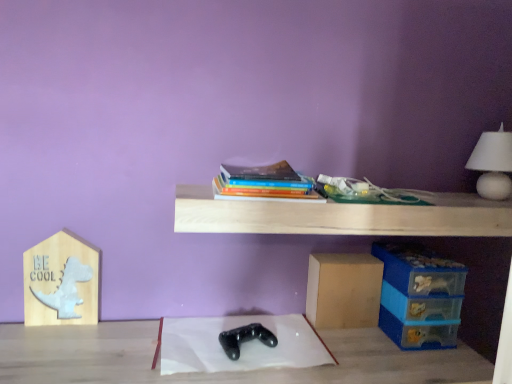
The image size is (512, 384). I want to click on wooden sign at left, arranged as the first cardboard box when viewed from the left, so click(61, 281).

Consider the image. What is the approximate width of wooden sign at left, positioned as the 2th cardboard box in back-to-front order?

It is 1.55 inches.

The height and width of the screenshot is (384, 512). What do you see at coordinates (240, 346) in the screenshot? I see `white paper at center` at bounding box center [240, 346].

Where is `white matte table lamp at upper right`? The image size is (512, 384). white matte table lamp at upper right is located at coordinates (493, 164).

Find the location of a particular element. The height and width of the screenshot is (384, 512). wooden sign at left, the second cardboard box in the right-to-left sequence is located at coordinates (61, 281).

Who is shorter, white matte table lamp at upper right or blue plastic storage box at lower right?

white matte table lamp at upper right.

Is white matte table lamp at upper right next to blue plastic storage box at lower right?

No, white matte table lamp at upper right is not next to blue plastic storage box at lower right.

Is point (482, 183) closer to viewer compared to point (419, 318)?

No, it is behind (419, 318).

Does blue plastic storage box at lower right have a lesser width compared to matte cardboard box at lower center, the 2th cardboard box from the front?

Incorrect, the width of blue plastic storage box at lower right is not less than that of matte cardboard box at lower center, the 2th cardboard box from the front.

Considering the positions of objects blue plastic storage box at lower right and matte cardboard box at lower center, the 1th cardboard box from the right, in the image provided, who is more to the right, blue plastic storage box at lower right or matte cardboard box at lower center, the 1th cardboard box from the right,?

Positioned to the right is blue plastic storage box at lower right.

Identify the location of the 1st cardboard box positioned above the blue plastic storage box at lower right (from the image's perspective). (343, 290).

Considering the sizes of objects blue plastic storage box at lower right and matte cardboard box at lower center, which is the second cardboard box in left-to-right order, in the image provided, who is smaller, blue plastic storage box at lower right or matte cardboard box at lower center, which is the second cardboard box in left-to-right order,?

Smaller between the two is matte cardboard box at lower center, which is the second cardboard box in left-to-right order.

Which object is positioned more to the right, blue plastic storage box at lower right or wooden sign at left, positioned as the 2th cardboard box in back-to-front order?

From the viewer's perspective, blue plastic storage box at lower right appears more on the right side.

Would you say wooden sign at left, the 1th cardboard box when ordered from front to back, is part of blue plastic storage box at lower right's contents?

No, wooden sign at left, the 1th cardboard box when ordered from front to back, is not inside blue plastic storage box at lower right.

Is blue plastic storage box at lower right bigger or smaller than wooden sign at left, the second cardboard box in the right-to-left sequence?

Considering their sizes, blue plastic storage box at lower right takes up more space than wooden sign at left, the second cardboard box in the right-to-left sequence.

Looking at this image, considering the sizes of objects blue plastic storage box at lower right and wooden sign at left, arranged as the first cardboard box when viewed from the left, in the image provided, who is shorter, blue plastic storage box at lower right or wooden sign at left, arranged as the first cardboard box when viewed from the left,?

blue plastic storage box at lower right.

Is blue plastic storage box at lower right looking in the opposite direction of light wood shelf at upper center?

No, blue plastic storage box at lower right's orientation is not away from light wood shelf at upper center.

Between blue plastic storage box at lower right and light wood shelf at upper center, which one has larger width?

With larger width is blue plastic storage box at lower right.

Considering the relative sizes of blue plastic storage box at lower right and light wood shelf at upper center in the image provided, is blue plastic storage box at lower right taller than light wood shelf at upper center?

Correct, blue plastic storage box at lower right is much taller as light wood shelf at upper center.

Is light wood shelf at upper center inside blue plastic storage box at lower right?

That's incorrect, light wood shelf at upper center is not inside blue plastic storage box at lower right.

Is white matte table lamp at upper right turned away from light wood shelf at upper center?

No.

Between white matte table lamp at upper right and light wood shelf at upper center, which one has less height?

With less height is light wood shelf at upper center.

Find the location of a particular element. Image resolution: width=512 pixels, height=384 pixels. table lamp lying on the right of light wood shelf at upper center is located at coordinates (493, 164).

Is white matte table lamp at upper right far away from light wood shelf at upper center?

No, white matte table lamp at upper right is in close proximity to light wood shelf at upper center.

Relative to blue plastic storage box at lower right, is white paper at center in front or behind?

white paper at center is in front of blue plastic storage box at lower right.

Which of these two, white paper at center or blue plastic storage box at lower right, is thinner?

Thinner between the two is blue plastic storage box at lower right.

Is blue plastic storage box at lower right completely or partially inside white paper at center?

No.

Between white paper at center and blue plastic storage box at lower right, which one has more height?

→ Standing taller between the two is blue plastic storage box at lower right.

Is the depth of white matte table lamp at upper right less than that of white paper at center?

No, white matte table lamp at upper right is behind white paper at center.

From a real-world perspective, who is located higher, white matte table lamp at upper right or white paper at center?

white matte table lamp at upper right, from a real-world perspective.

How far apart are white matte table lamp at upper right and white paper at center?

white matte table lamp at upper right and white paper at center are 33.00 inches apart.

Is point (489, 160) closer to camera compared to point (199, 350)?

No, (489, 160) is behind (199, 350).

You are a GUI agent. You are given a task and a screenshot of the screen. Output one action in this format:
    pyautogui.click(x=<x>, y=<y>)
    Task: Click on the table lamp to the right of blue plastic storage box at lower right
    
    Given the screenshot: What is the action you would take?
    pyautogui.click(x=493, y=164)

Find the location of a particular element. The width and height of the screenshot is (512, 384). cardboard box that is the 1st one when counting leftward from the blue plastic storage box at lower right is located at coordinates (343, 290).

From the image, which object appears to be farther from matte cardboard box at lower center, the 1th cardboard box from the right, white paper at center or wooden sign at left, arranged as the first cardboard box when viewed from the left?

wooden sign at left, arranged as the first cardboard box when viewed from the left, is further to matte cardboard box at lower center, the 1th cardboard box from the right.

Estimate the real-world distances between objects in this image. Which object is closer to light wood shelf at upper center, white paper at center or wooden sign at left, the 1th cardboard box when ordered from front to back?

Based on the image, white paper at center appears to be nearer to light wood shelf at upper center.

When comparing their distances from light wood shelf at upper center, does blue plastic storage box at lower right or matte cardboard box at lower center, the 1th cardboard box positioned from the back, seem further?

matte cardboard box at lower center, the 1th cardboard box positioned from the back, is positioned further to the anchor light wood shelf at upper center.

Which object lies further to the anchor point white paper at center, light wood shelf at upper center or hardcover books at center?

hardcover books at center.

Looking at the image, which one is located closer to matte cardboard box at lower center, the 1th cardboard box from the right, blue plastic storage box at lower right or white matte table lamp at upper right?

Among the two, blue plastic storage box at lower right is located nearer to matte cardboard box at lower center, the 1th cardboard box from the right.

Which object lies further to the anchor point white paper at center, light wood shelf at upper center or blue plastic storage box at lower right?

blue plastic storage box at lower right lies further to white paper at center than the other object.

Considering their positions, is hardcover books at center positioned closer to wooden sign at left, the 1th cardboard box when ordered from front to back, than white paper at center?

Based on the image, white paper at center appears to be nearer to wooden sign at left, the 1th cardboard box when ordered from front to back.

Estimate the real-world distances between objects in this image. Which object is closer to blue plastic storage box at lower right, white paper at center or matte cardboard box at lower center, which is the second cardboard box in left-to-right order?

Among the two, matte cardboard box at lower center, which is the second cardboard box in left-to-right order, is located nearer to blue plastic storage box at lower right.

This screenshot has height=384, width=512. I want to click on cardboard box situated between white paper at center and blue plastic storage box at lower right from left to right, so click(343, 290).

You are a GUI agent. You are given a task and a screenshot of the screen. Output one action in this format:
    pyautogui.click(x=<x>, y=<y>)
    Task: Click on the cardboard box between white paper at center and light wood shelf at upper center
    
    Given the screenshot: What is the action you would take?
    pyautogui.click(x=343, y=290)

This screenshot has width=512, height=384. Identify the location of shelf between white paper at center and white matte table lamp at upper right from left to right. (342, 216).

Where is `paperback book situated between wooden sign at left, the second cardboard box in the right-to-left sequence, and matte cardboard box at lower center, the 1th cardboard box positioned from the back, from left to right`? paperback book situated between wooden sign at left, the second cardboard box in the right-to-left sequence, and matte cardboard box at lower center, the 1th cardboard box positioned from the back, from left to right is located at coordinates (265, 183).